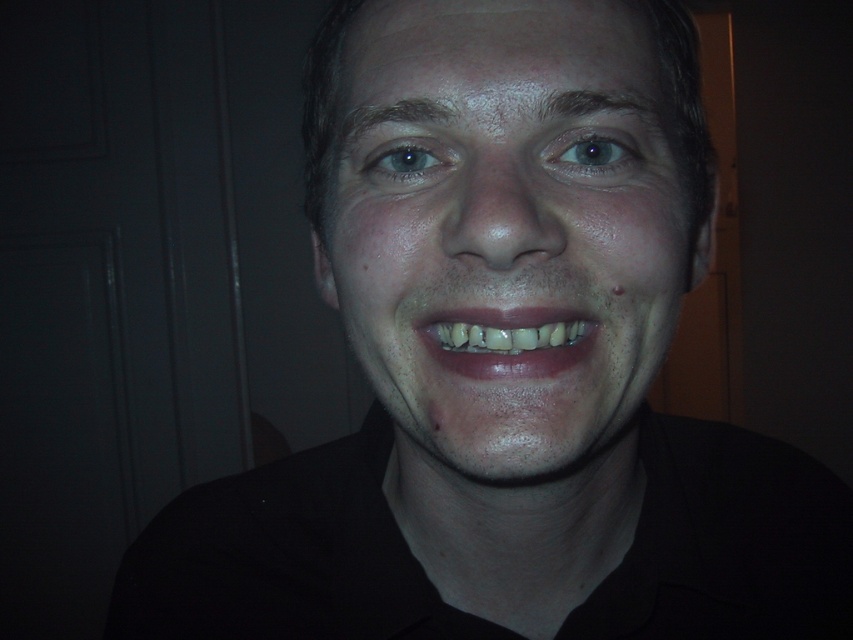
Is smooth skin face at center below natural teeth at center?

No, smooth skin face at center is not below natural teeth at center.

Is point (407, 144) closer to viewer compared to point (461, 321)?

No, it is behind (461, 321).

Identify the location of smooth skin face at center. (506, 230).

Can you confirm if smooth skin face at center is positioned below black matte neck at center?

Actually, smooth skin face at center is above black matte neck at center.

Can you confirm if smooth skin face at center is positioned to the left of black matte neck at center?

In fact, smooth skin face at center is to the right of black matte neck at center.

Who is more forward, (x=368, y=67) or (x=793, y=456)?

Positioned in front is point (x=368, y=67).

The height and width of the screenshot is (640, 853). I want to click on smooth skin face at center, so click(506, 230).

From the picture: How much distance is there between black matte neck at center and natural teeth at center?

black matte neck at center and natural teeth at center are 7.41 inches apart from each other.

Is black matte neck at center above natural teeth at center?

No, black matte neck at center is not above natural teeth at center.

What do you see at coordinates (286, 556) in the screenshot? I see `black matte neck at center` at bounding box center [286, 556].

You are a GUI agent. You are given a task and a screenshot of the screen. Output one action in this format:
    pyautogui.click(x=<x>, y=<y>)
    Task: Click on the black matte neck at center
    The height and width of the screenshot is (640, 853).
    Given the screenshot: What is the action you would take?
    pyautogui.click(x=286, y=556)